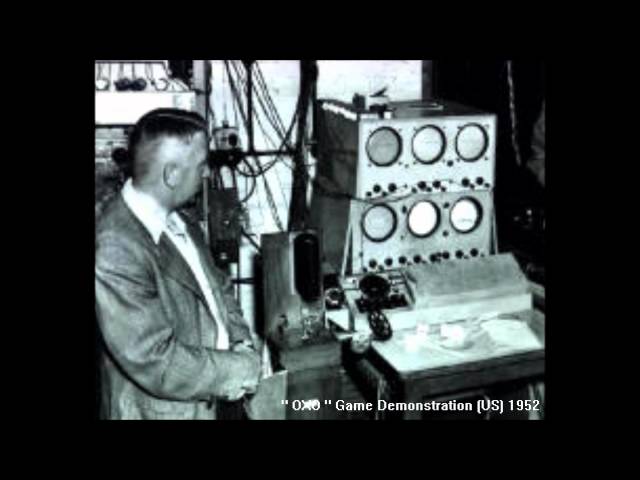
Locate an element on the screen. cables is located at coordinates (265, 86), (237, 106), (242, 87), (262, 102), (266, 183).